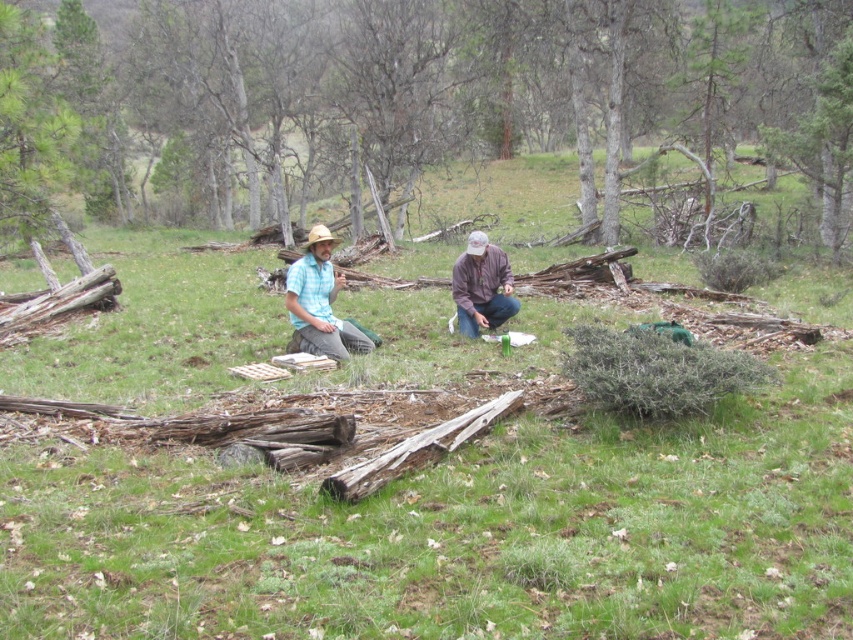
From the picture: You are trying to decide whether to place a small picnic basket between the smooth bark tree at center and the light blue plaid shirt at center. Based on their widths, can the basket fit between them?

The smooth bark tree at center might be wider than the light blue plaid shirt at center, so the basket may not fit between them if the tree is wider.

You are trying to take a photo of the smooth bark tree at center and the light blue plaid shirt at center from a distance. Which object will appear closer to you in the photo?

The smooth bark tree at center will appear closer to you in the photo because it is further to the viewer than the light blue plaid shirt at center, making it positioned nearer in the visual frame.